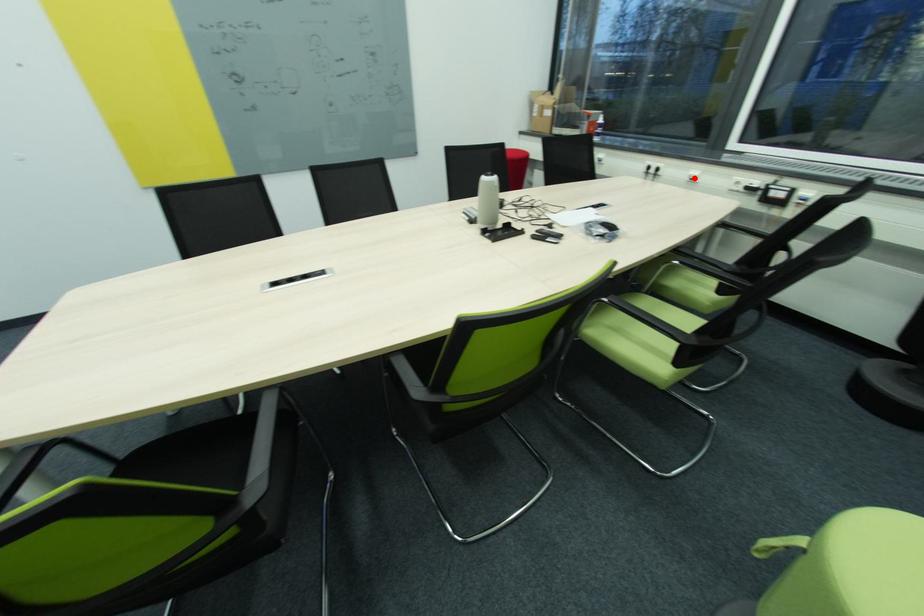
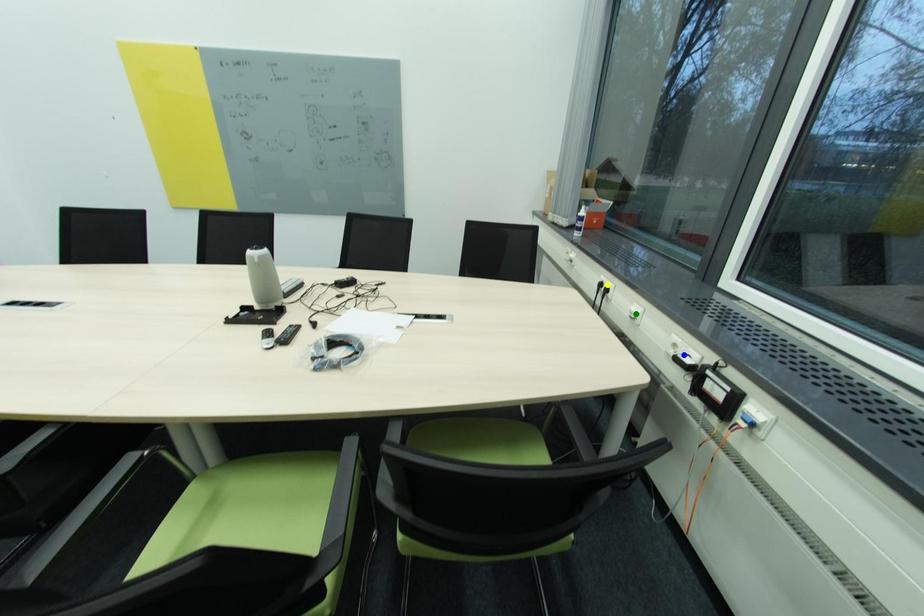
Question: I am providing you with two images of the same scene from different viewpoints. A red point is marked on the first image. You are given multiple points on the second image. Can you choose the point in image 2 that corresponds to the point in image 1?

Choices:
 (A) blue point
 (B) green point
 (C) yellow point

Answer: (B)